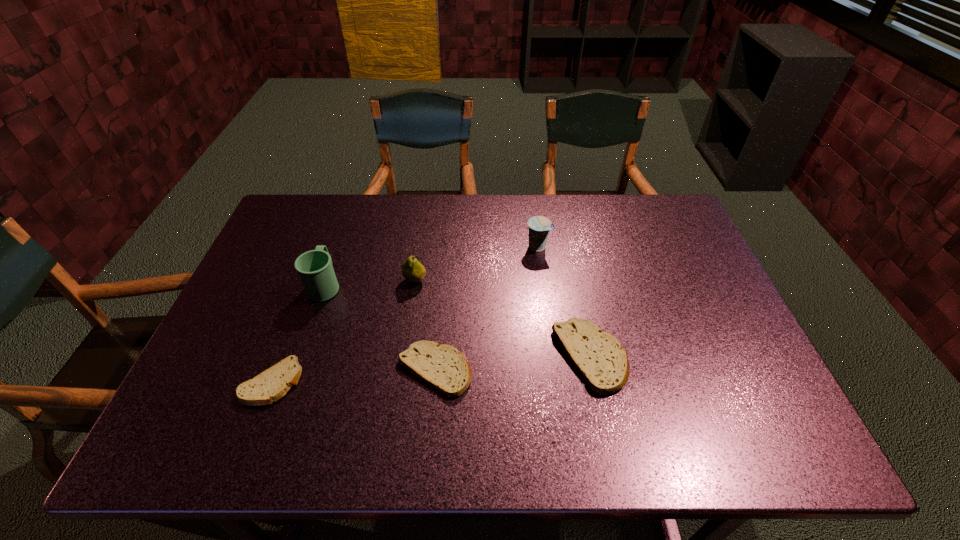
Where is `the leftmost pita bread`? This screenshot has width=960, height=540. the leftmost pita bread is located at coordinates (272, 384).

Where is `the shortest object`? the shortest object is located at coordinates (272, 384).

This screenshot has width=960, height=540. What are the coordinates of `the second pita bread from right to left` in the screenshot? It's located at (445, 368).

Identify the location of the second shortest object. This screenshot has height=540, width=960. pyautogui.click(x=445, y=368).

This screenshot has height=540, width=960. What are the coordinates of `the fourth tallest object` in the screenshot? It's located at (599, 358).

Identify the location of the tallest pita bread. (599, 358).

Image resolution: width=960 pixels, height=540 pixels. I want to click on mug, so click(x=314, y=267).

This screenshot has height=540, width=960. Identify the location of yogurt. (539, 226).

Identify the location of pear. This screenshot has width=960, height=540. (412, 270).

Locate an element on the screen. This screenshot has width=960, height=540. free space located 0.360m on the back of the shortest pita bread is located at coordinates pos(319,259).